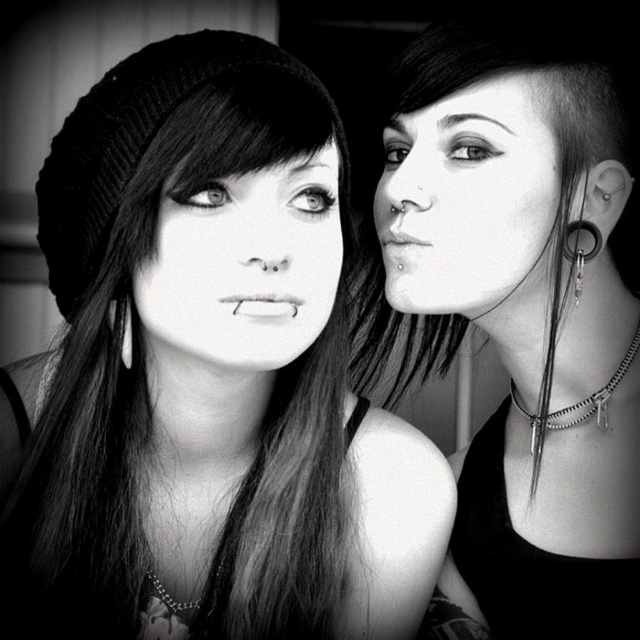
You are taking a photo with a camera that has a focal length of 50mm. The knitted beanie at upper left is 20 inches away from the camera. If you want to focus on the beanie, what should you adjust on your camera?

To focus on the knitted beanie at upper left, which is 20 inches away from the camera, you should adjust the focus ring to set the focus distance to approximately 20 inches.

You are a photographer adjusting lighting for a closeup shot of the two people in the image. You need to ensure the shiny silver earring at upper right and the smooth skin face at right are both well lit. Since the earring is larger than the face, which object requires more focused lighting to maintain balance?

The shiny silver earring at upper right requires more focused lighting because it has a larger size compared to the smooth skin face at right, so to maintain balance in the lighting, the larger earring needs more attention to ensure it doesn t overpower the face.

You are a photographer adjusting the focus on your camera. You notice two knitted beanies in the frame. The knitted beanie at upper left and the knitted black beanie at left. Which one is taller in the image?

The knitted beanie at upper left is much taller than the knitted black beanie at left.